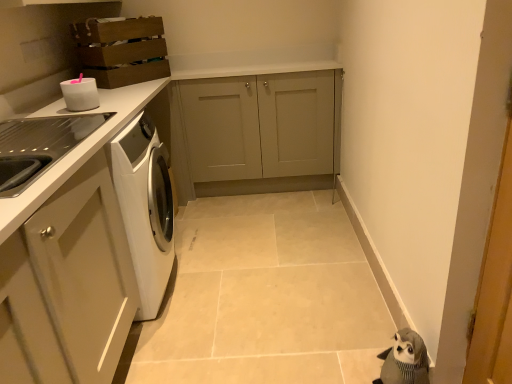
Question: Does wooden crate at upper left, the 1th cabinetry from the left, have a greater width compared to matte gray cabinet at center, placed as the first cabinetry when sorted from right to left?

Choices:
 (A) yes
 (B) no

Answer: (A)

Question: Is wooden crate at upper left, the second cabinetry when ordered from right to left, not near matte gray cabinet at center, placed as the first cabinetry when sorted from right to left?

Choices:
 (A) no
 (B) yes

Answer: (A)

Question: From the image's perspective, is wooden crate at upper left, the second cabinetry when ordered from right to left, below matte gray cabinet at center, placed as the first cabinetry when sorted from right to left?

Choices:
 (A) no
 (B) yes

Answer: (A)

Question: Considering the relative sizes of wooden crate at upper left, the 1th cabinetry from the left, and matte gray cabinet at center, placed as the first cabinetry when sorted from right to left, in the image provided, is wooden crate at upper left, the 1th cabinetry from the left, smaller than matte gray cabinet at center, placed as the first cabinetry when sorted from right to left,?

Choices:
 (A) no
 (B) yes

Answer: (B)

Question: Can matte gray cabinet at center, the second cabinetry viewed from the left, be found inside wooden crate at upper left, the second cabinetry when ordered from right to left?

Choices:
 (A) no
 (B) yes

Answer: (A)

Question: From a real-world perspective, is white glossy container at upper left physically located above or below white glossy countertop at left?

Choices:
 (A) above
 (B) below

Answer: (A)

Question: Considering the relative positions of white glossy container at upper left and white glossy countertop at left in the image provided, is white glossy container at upper left to the left or to the right of white glossy countertop at left?

Choices:
 (A) left
 (B) right

Answer: (A)

Question: In terms of height, does white glossy container at upper left look taller or shorter compared to white glossy countertop at left?

Choices:
 (A) short
 (B) tall

Answer: (A)

Question: Is point (80, 92) positioned closer to the camera than point (118, 112)?

Choices:
 (A) farther
 (B) closer

Answer: (A)

Question: From the image's perspective, is white glossy container at upper left positioned above or below wooden crate at upper left, the second cabinetry when ordered from right to left?

Choices:
 (A) above
 (B) below

Answer: (B)

Question: Considering the positions of white glossy container at upper left and wooden crate at upper left, the second cabinetry when ordered from right to left, in the image, is white glossy container at upper left taller or shorter than wooden crate at upper left, the second cabinetry when ordered from right to left,?

Choices:
 (A) short
 (B) tall

Answer: (A)

Question: Considering their positions, is white glossy container at upper left located in front of or behind wooden crate at upper left, the second cabinetry when ordered from right to left?

Choices:
 (A) front
 (B) behind

Answer: (A)

Question: Looking at their shapes, would you say white glossy container at upper left is wider or thinner than wooden crate at upper left, the 1th cabinetry from the left?

Choices:
 (A) wide
 (B) thin

Answer: (B)

Question: Is matte gray cabinet at center, placed as the first cabinetry when sorted from right to left, situated inside white glossy container at upper left or outside?

Choices:
 (A) inside
 (B) outside

Answer: (B)

Question: Is point (210, 117) positioned closer to the camera than point (82, 89)?

Choices:
 (A) closer
 (B) farther

Answer: (B)